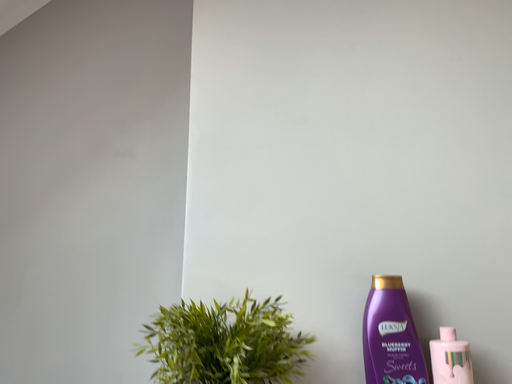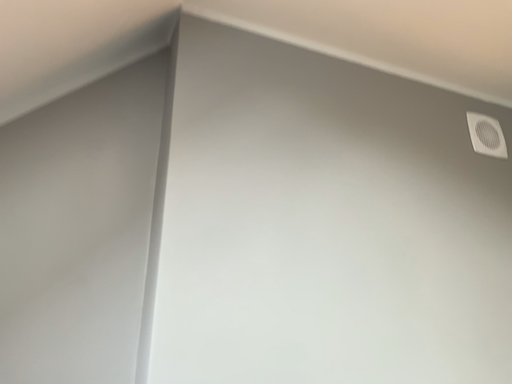
Question: Which way did the camera rotate in the video?

Choices:
 (A) rotated upward
 (B) rotated downward

Answer: (A)